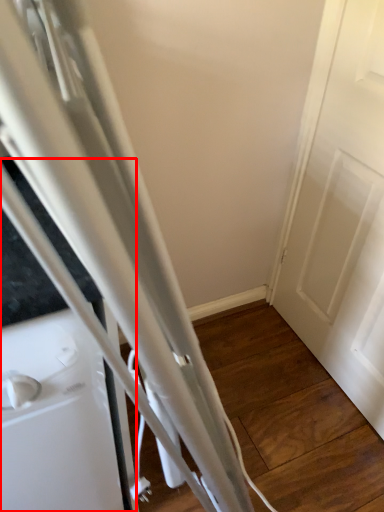
Question: In this image, where is appliance (annotated by the red box) located relative to door?

Choices:
 (A) right
 (B) left

Answer: (B)